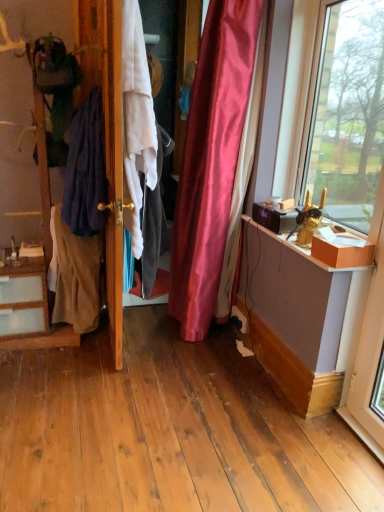
Identify the location of dark blue fabric at left, the second clothing in the right-to-left sequence. This screenshot has height=512, width=384. (86, 169).

You are a GUI agent. You are given a task and a screenshot of the screen. Output one action in this format:
    pyautogui.click(x=<x>, y=<y>)
    Task: Click on the white cotton shirt at center, which appears as the third clothing when viewed from the left
    The height and width of the screenshot is (512, 384).
    Given the screenshot: What is the action you would take?
    pyautogui.click(x=153, y=221)

Identify the location of wooden door at center. (113, 164).

In order to click on wooden dresser at left in this screenshot , I will do `click(105, 75)`.

The width and height of the screenshot is (384, 512). Describe the element at coordinates (105, 75) in the screenshot. I see `wooden dresser at left` at that location.

Where is `dark blue fabric at left, the 3th clothing positioned from the right`? This screenshot has height=512, width=384. dark blue fabric at left, the 3th clothing positioned from the right is located at coordinates (74, 276).

Is wooden door at center positioned beyond the bounds of white cotton shirt at center, which appears as the third clothing when viewed from the left?

Yes, wooden door at center is located beyond the bounds of white cotton shirt at center, which appears as the third clothing when viewed from the left.

Between wooden door at center and white cotton shirt at center, which appears as the third clothing when viewed from the left, which one has less height?

white cotton shirt at center, which appears as the third clothing when viewed from the left, is shorter.

Are wooden door at center and white cotton shirt at center, which appears as the third clothing when viewed from the left, far apart?

That's not correct — wooden door at center is a little close to white cotton shirt at center, which appears as the third clothing when viewed from the left.

Considering the positions of point (101, 27) and point (143, 183), is point (101, 27) closer or farther from the camera than point (143, 183)?

Point (101, 27).

From a real-world perspective, is dark blue fabric at left, the 1th clothing viewed from the left, on wooden dresser at left?

Actually, dark blue fabric at left, the 1th clothing viewed from the left, is physically below wooden dresser at left in the real world.

Is dark blue fabric at left, the 3th clothing positioned from the right, bigger than wooden dresser at left?

Incorrect, dark blue fabric at left, the 3th clothing positioned from the right, is not larger than wooden dresser at left.

Is wooden dresser at left surrounded by dark blue fabric at left, the 1th clothing viewed from the left?

No, wooden dresser at left is not a part of dark blue fabric at left, the 1th clothing viewed from the left.

How distant is dark blue fabric at left, the 1th clothing viewed from the left, from wooden dresser at left?

A distance of 16.03 inches exists between dark blue fabric at left, the 1th clothing viewed from the left, and wooden dresser at left.

Is wooden door at center to the left or to the right of wooden dresser at left in the image?

wooden door at center is to the right of wooden dresser at left.

Is wooden door at center aimed at wooden dresser at left?

No.

From a real-world perspective, which object stands above the other?

In real-world perspective, wooden door at center is above.

Would you say wooden door at center contains wooden dresser at left?

No, wooden dresser at left is not inside wooden door at center.

Find the location of a particular element. The height and width of the screenshot is (512, 384). dresser that is on the left side of white cotton shirt at center, marked as the first clothing in a right-to-left arrangement is located at coordinates (105, 75).

Between white cotton shirt at center, marked as the first clothing in a right-to-left arrangement, and wooden dresser at left, which one has more height?

wooden dresser at left is taller.

Consider the image. Can wooden dresser at left be found inside white cotton shirt at center, marked as the first clothing in a right-to-left arrangement?

No.

Where is `dresser that appears in front of the dark blue fabric at left, the second clothing in the right-to-left sequence`? The image size is (384, 512). dresser that appears in front of the dark blue fabric at left, the second clothing in the right-to-left sequence is located at coordinates 105,75.

How different are the orientations of dark blue fabric at left, positioned as the second clothing in left-to-right order, and wooden dresser at left in degrees?

They differ by 0.00118 degrees in their facing directions.

From the image's perspective, which is below, dark blue fabric at left, the second clothing in the right-to-left sequence, or wooden dresser at left?

From the image's view, wooden dresser at left is below.

Which is less distant, (100, 170) or (117, 229)?

Positioned in front is point (117, 229).

From a real-world perspective, does white cotton shirt at center, marked as the first clothing in a right-to-left arrangement, sit lower than dark blue fabric at left, the 1th clothing viewed from the left?

No, from a real-world perspective, white cotton shirt at center, marked as the first clothing in a right-to-left arrangement, is not under dark blue fabric at left, the 1th clothing viewed from the left.

What are the coordinates of `clothing below the white cotton shirt at center, which appears as the third clothing when viewed from the left (from a real-world perspective)` in the screenshot? It's located at (74, 276).

Is point (148, 216) positioned behind point (97, 247)?

No, (148, 216) is closer to viewer.

Are wooden dresser at left and dark blue fabric at left, the second clothing in the right-to-left sequence, beside each other?

No, wooden dresser at left is not touching dark blue fabric at left, the second clothing in the right-to-left sequence.

Can you tell me how much wooden dresser at left and dark blue fabric at left, the second clothing in the right-to-left sequence, differ in facing direction?

0.00118 degrees.

Find the location of a particular element. This screenshot has height=512, width=384. dresser in front of the dark blue fabric at left, positioned as the second clothing in left-to-right order is located at coordinates (105, 75).

Is point (35, 114) closer to viewer compared to point (102, 179)?

Yes.

Locate an element on the screen. the 1st clothing positioned below the wooden door at center (from the image's perspective) is located at coordinates (153, 221).

Starting from the wooden dresser at left, which clothing is the 3rd one behind? Please provide its 2D coordinates.

[(74, 276)]

Which object lies further to the anchor point dark blue fabric at left, the 3th clothing positioned from the right, white cotton shirt at center, which appears as the third clothing when viewed from the left, or wooden door at center?

wooden door at center lies further to dark blue fabric at left, the 3th clothing positioned from the right, than the other object.

From the image, which object appears to be farther from dark blue fabric at left, the 1th clothing viewed from the left, wooden dresser at left or wooden door at center?

Among the two, wooden dresser at left is located further to dark blue fabric at left, the 1th clothing viewed from the left.

Considering their positions, is dark blue fabric at left, positioned as the second clothing in left-to-right order, positioned further to wooden dresser at left than white cotton shirt at center, marked as the first clothing in a right-to-left arrangement?

white cotton shirt at center, marked as the first clothing in a right-to-left arrangement, is further to wooden dresser at left.

From the image, which object appears to be nearer to wooden door at center, dark blue fabric at left, the 1th clothing viewed from the left, or white cotton shirt at center, which appears as the third clothing when viewed from the left?

Based on the image, white cotton shirt at center, which appears as the third clothing when viewed from the left, appears to be nearer to wooden door at center.

Looking at this image, based on their spatial positions, is white cotton shirt at center, which appears as the third clothing when viewed from the left, or wooden dresser at left further from wooden door at center?

white cotton shirt at center, which appears as the third clothing when viewed from the left, is further to wooden door at center.

Which object lies further to the anchor point dark blue fabric at left, positioned as the second clothing in left-to-right order, white cotton shirt at center, marked as the first clothing in a right-to-left arrangement, or wooden dresser at left?

The object further to dark blue fabric at left, positioned as the second clothing in left-to-right order, is white cotton shirt at center, marked as the first clothing in a right-to-left arrangement.

When comparing their distances from wooden dresser at left, does white cotton shirt at center, which appears as the third clothing when viewed from the left, or dark blue fabric at left, the 1th clothing viewed from the left, seem further?

white cotton shirt at center, which appears as the third clothing when viewed from the left, lies further to wooden dresser at left than the other object.

Estimate the real-world distances between objects in this image. Which object is closer to wooden door at center, white cotton shirt at center, marked as the first clothing in a right-to-left arrangement, or dark blue fabric at left, positioned as the second clothing in left-to-right order?

dark blue fabric at left, positioned as the second clothing in left-to-right order, is closer to wooden door at center.

This screenshot has width=384, height=512. Identify the location of dresser between wooden door at center and dark blue fabric at left, the second clothing in the right-to-left sequence, along the z-axis. (105, 75).

The height and width of the screenshot is (512, 384). What are the coordinates of `dresser between dark blue fabric at left, positioned as the second clothing in left-to-right order, and dark blue fabric at left, the 3th clothing positioned from the right, in the vertical direction` in the screenshot? It's located at (105, 75).

In order to click on door situated between wooden dresser at left and white cotton shirt at center, which appears as the third clothing when viewed from the left, from left to right in this screenshot , I will do `click(113, 164)`.

At what (x,y) coordinates should I click in order to perform the action: click on clothing situated between dark blue fabric at left, the 3th clothing positioned from the right, and white cotton shirt at center, which appears as the third clothing when viewed from the left, from left to right. Please return your answer as a coordinate pair (x, y). The image size is (384, 512). Looking at the image, I should click on (86, 169).